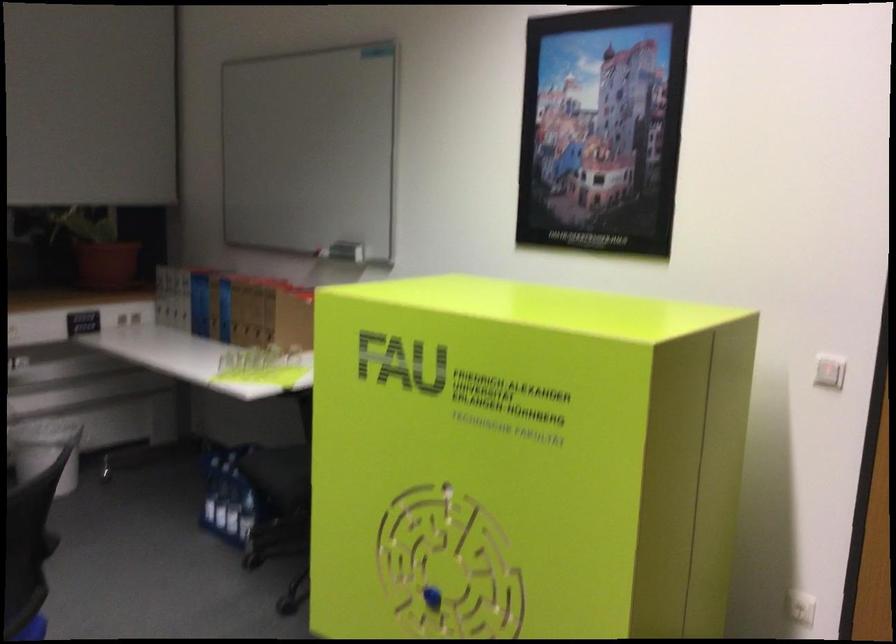
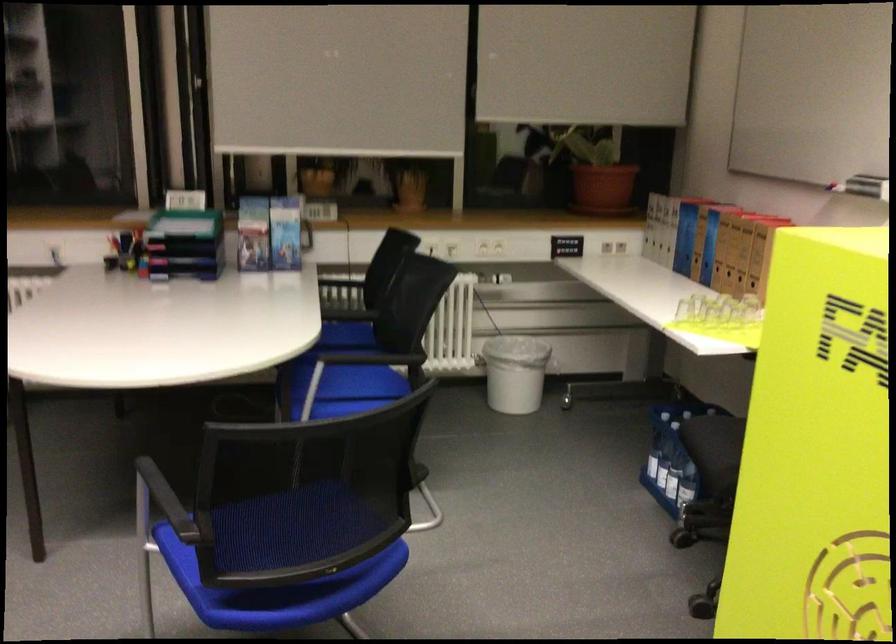
Question: Based on the continuous images, in which direction is the camera rotating? Reply with the corresponding letter.

Choices:
 (A) Left
 (B) Right
 (C) Up
 (D) Down

Answer: (A)